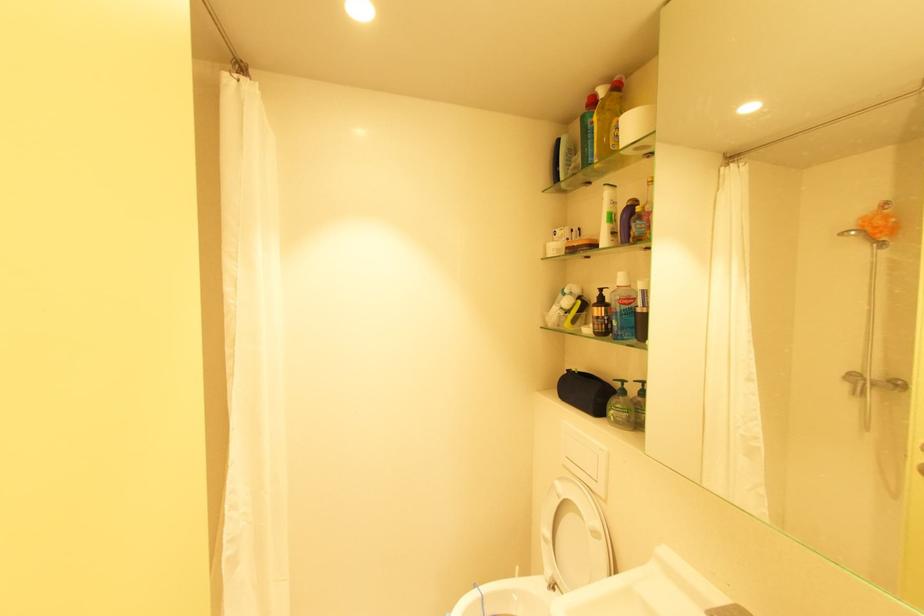
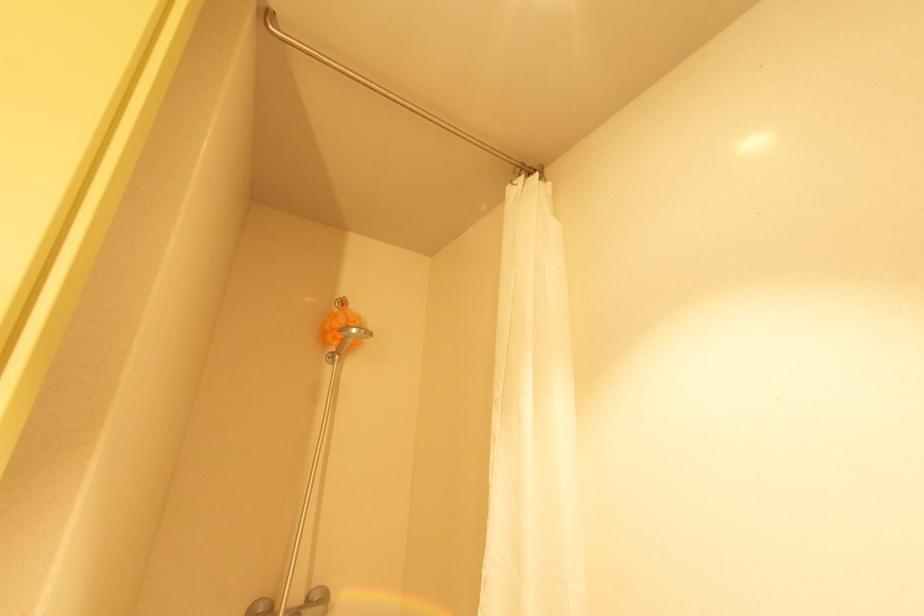
The first image is from the beginning of the video and the second image is from the end. How did the camera likely rotate when shooting the video?

The rotation direction of the camera is left-up.